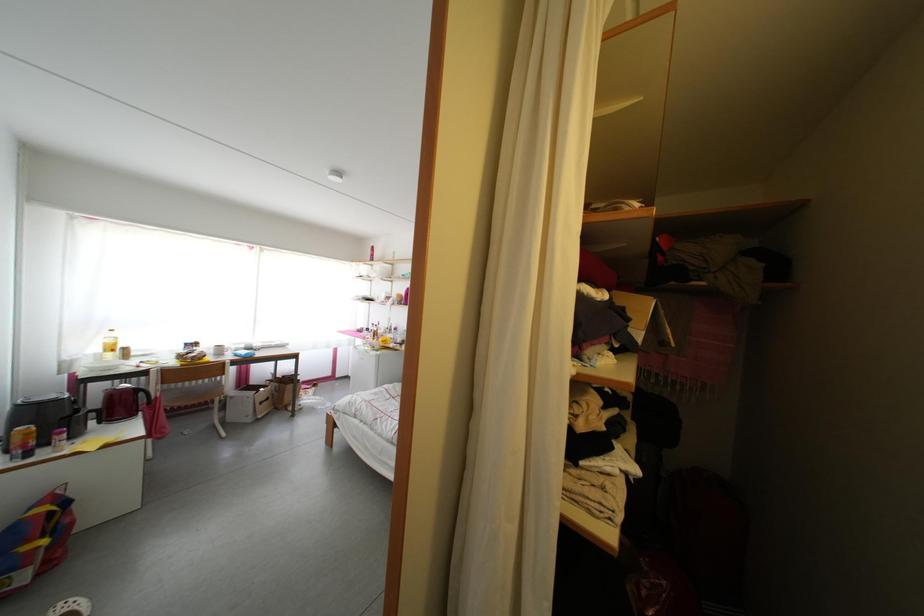
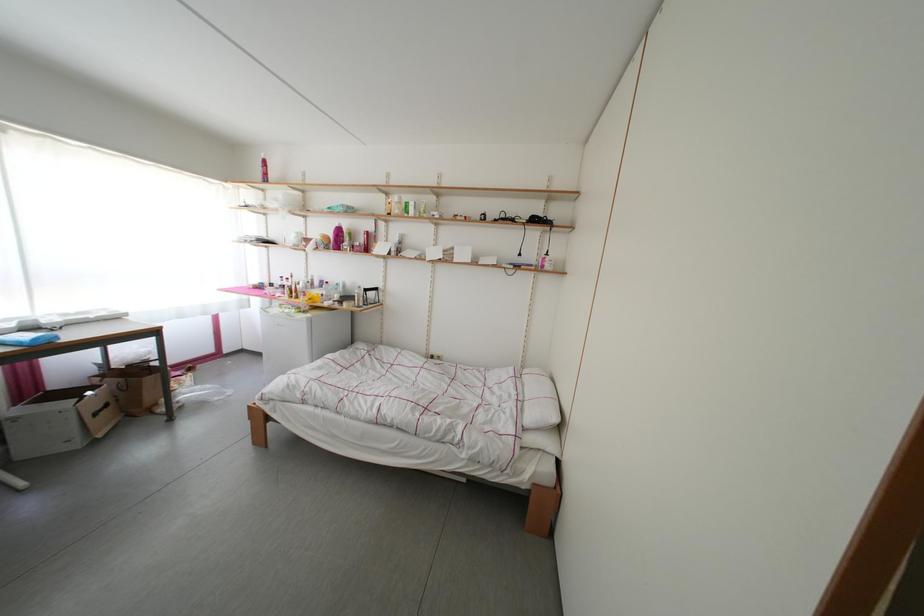
Question: The camera is either moving clockwise (left) or counter-clockwise (right) around the object. The first image is from the beginning of the video and the second image is from the end. Is the camera moving left or right when shooting the video?

Choices:
 (A) Left
 (B) Right

Answer: (A)